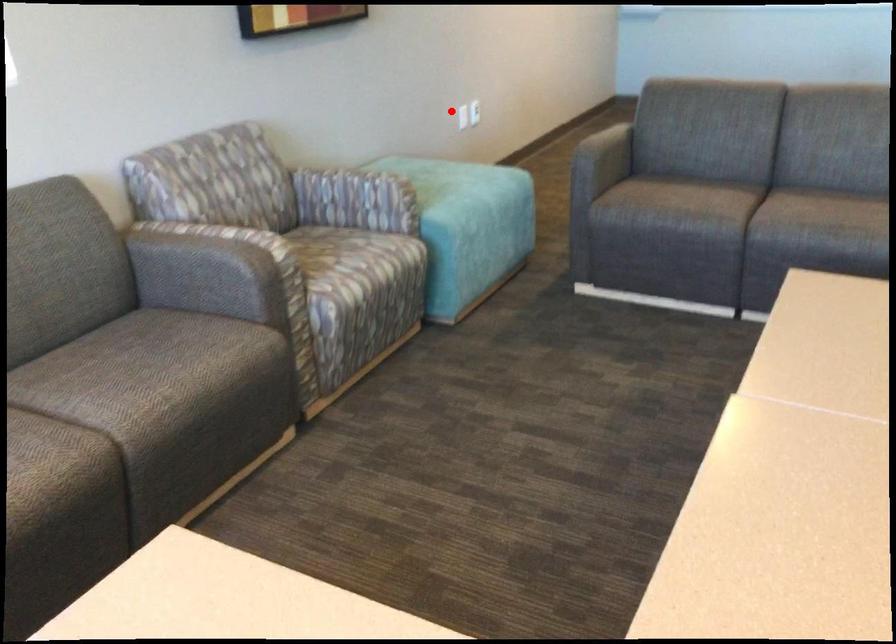
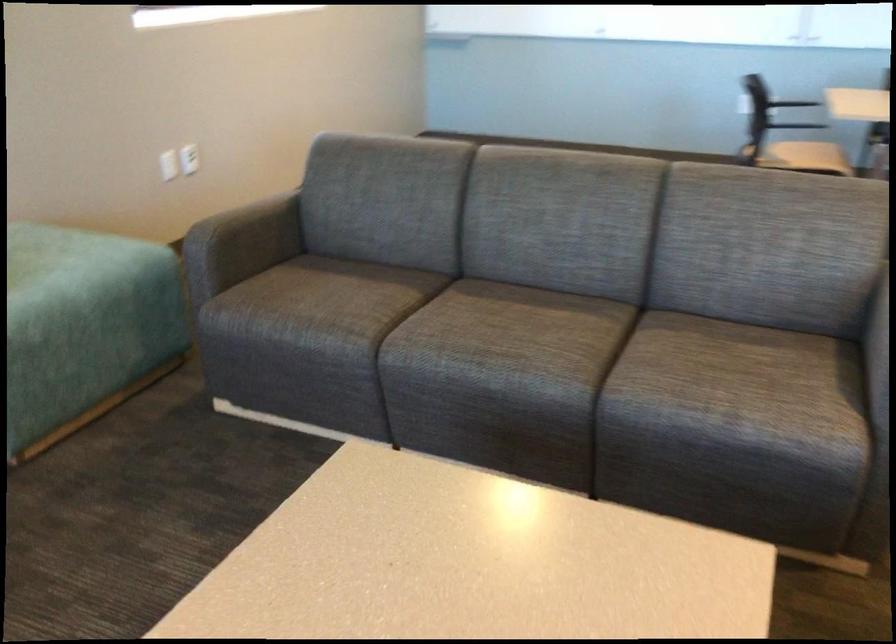
In the second image, find the point that corresponds to the highlighted location in the first image.

(168, 165)